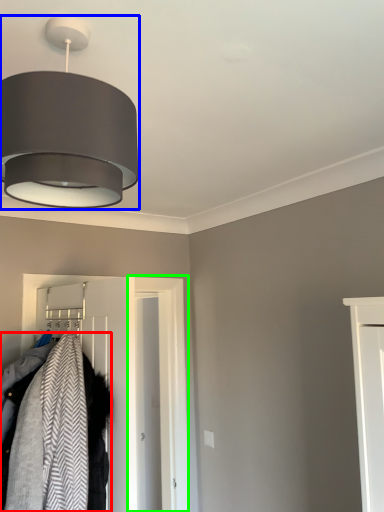
Question: Which is nearer to the laundry (highlighted by a red box)? lamp (highlighted by a blue box) or door (highlighted by a green box).

Choices:
 (A) lamp
 (B) door

Answer: (A)